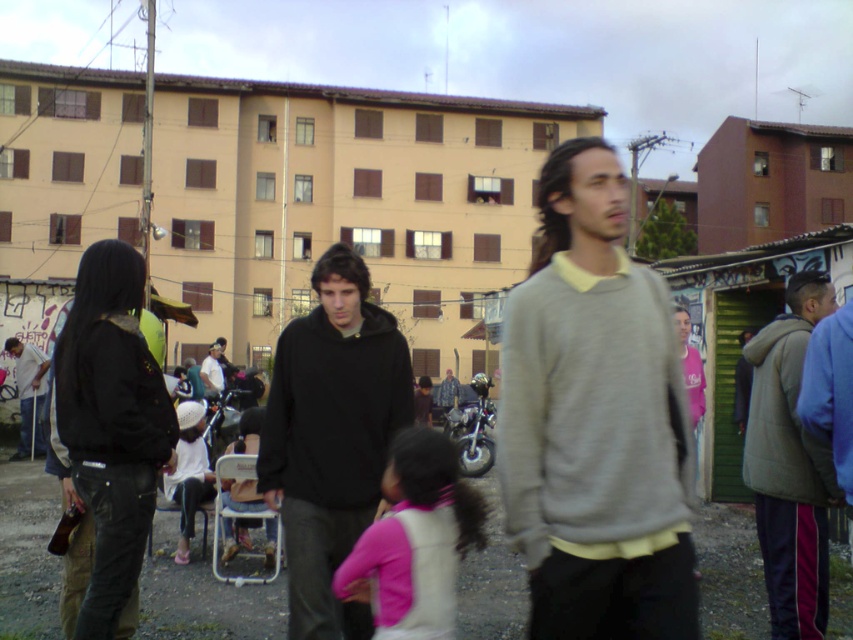
You are a delivery person carrying a package that is 10 cm thick. You need to place it between the black leather jacket at left and the shiny metallic motorcycle at center. Can the space between them accommodate the package?

The black leather jacket at left is thinner than the shiny metallic motorcycle at center, so the space between them can accommodate a package that is 10 cm thick.

You are a photographer trying to capture a photo of the black matte hoodie at center and the gray woolen sweater at right. Based on their positions, which one should you focus on first to ensure both are in the frame?

The black matte hoodie at center is located below the gray woolen sweater at right, so you should focus on the gray woolen sweater at right first to ensure both are in the frame.